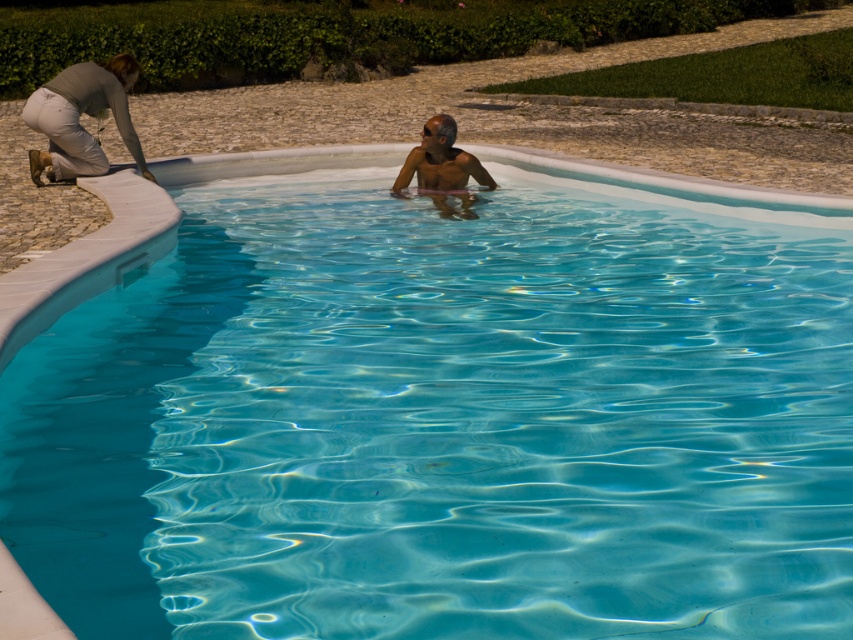
Question: Which object is positioned farthest from the green leafy hedge at upper center?

Choices:
 (A) light gray jeans at upper left
 (B) smooth skin man at center

Answer: (B)

Question: In this image, where is green leafy hedge at upper center located relative to smooth skin man at center?

Choices:
 (A) left
 (B) right

Answer: (B)

Question: Does green leafy hedge at upper center have a greater width compared to light gray jeans at upper left?

Choices:
 (A) no
 (B) yes

Answer: (B)

Question: Which point appears farthest from the camera in this image?

Choices:
 (A) (416, 48)
 (B) (67, 102)

Answer: (A)

Question: Is light gray jeans at upper left wider than smooth skin man at center?

Choices:
 (A) yes
 (B) no

Answer: (A)

Question: Among these objects, which one is nearest to the camera?

Choices:
 (A) green leafy hedge at upper center
 (B) smooth skin man at center
 (C) light gray jeans at upper left

Answer: (C)